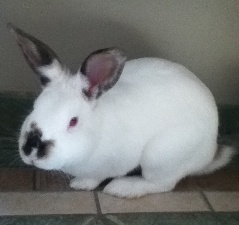
This screenshot has height=225, width=239. I want to click on green tile, so click(135, 220).